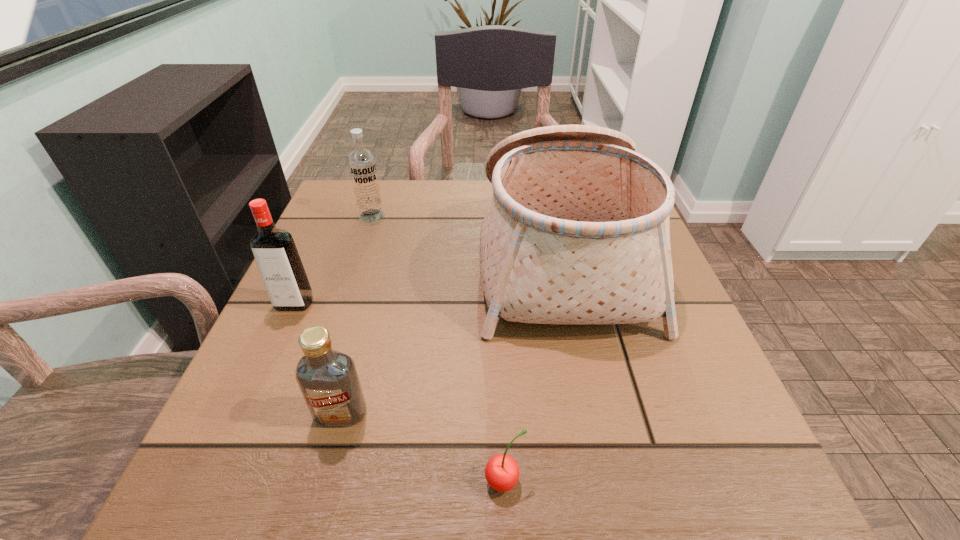
Select which vodka appears as the second closest to the second nearest object. Please provide its 2D coordinates. Your answer should be formatted as a tuple, i.e. [(x, y)], where the tuple contains the x and y coordinates of a point satisfying the conditions above.

[(362, 165)]

Find the location of `vacant point that satisfies the following two spatial constraints: 1. on the front label of the cherry; 2. on the left side of the farthest vodka`. vacant point that satisfies the following two spatial constraints: 1. on the front label of the cherry; 2. on the left side of the farthest vodka is located at coordinates (282, 481).

Where is `vacant space that satisfies the following two spatial constraints: 1. with the lid open on the tallest object; 2. on the front and back of the leftmost object`? The image size is (960, 540). vacant space that satisfies the following two spatial constraints: 1. with the lid open on the tallest object; 2. on the front and back of the leftmost object is located at coordinates (571, 304).

Where is `vacant position in the image that satisfies the following two spatial constraints: 1. on the front-facing side of the shortest object; 2. on the left side of the second shortest object`? This screenshot has height=540, width=960. vacant position in the image that satisfies the following two spatial constraints: 1. on the front-facing side of the shortest object; 2. on the left side of the second shortest object is located at coordinates (323, 481).

Identify the location of free space that satisfies the following two spatial constraints: 1. on the front and back of the cherry; 2. on the left side of the second nearest vodka. (215, 481).